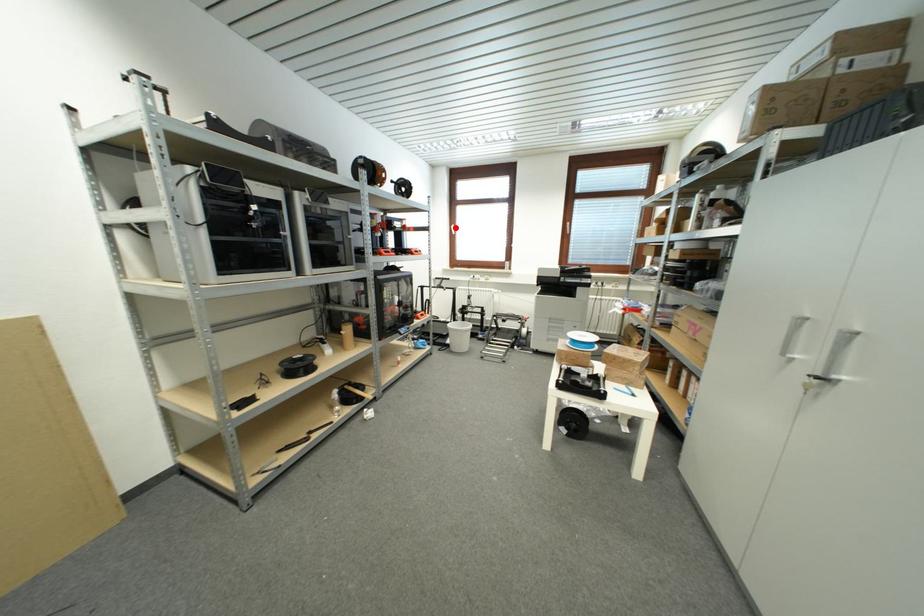
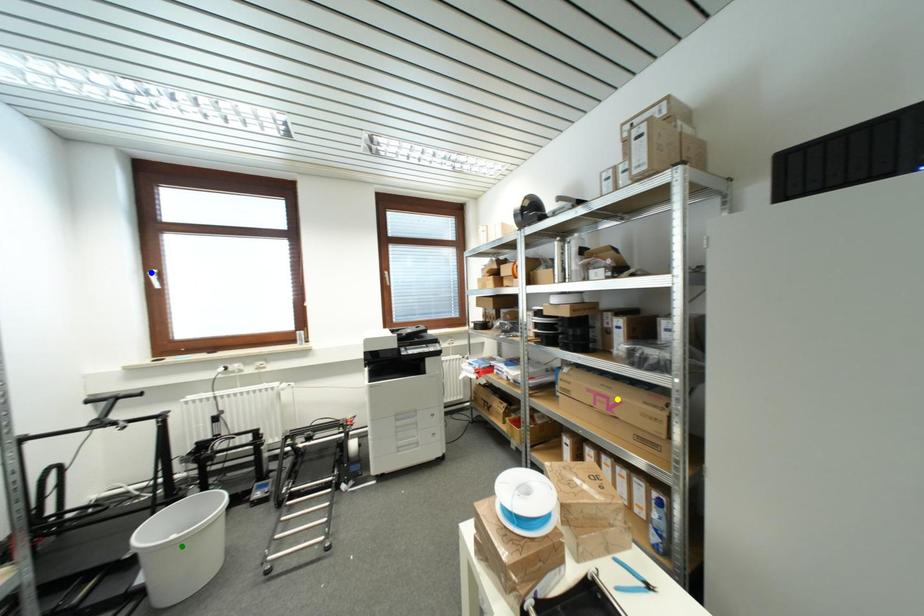
Question: I am providing you with two images of the same scene from different viewpoints. A red point is marked on the first image. You are given multiple points on the second image. Which spot in image 2 lines up with the point in image 1?

Choices:
 (A) green point
 (B) blue point
 (C) yellow point

Answer: (B)